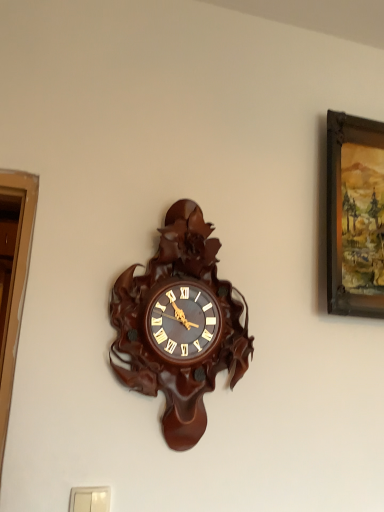
The height and width of the screenshot is (512, 384). Describe the element at coordinates (179, 324) in the screenshot. I see `polished dark wood clock at center` at that location.

The image size is (384, 512). In order to click on polished dark wood clock at center in this screenshot , I will do `click(179, 324)`.

Identify the location of polished dark wood clock at center. This screenshot has height=512, width=384. (179, 324).